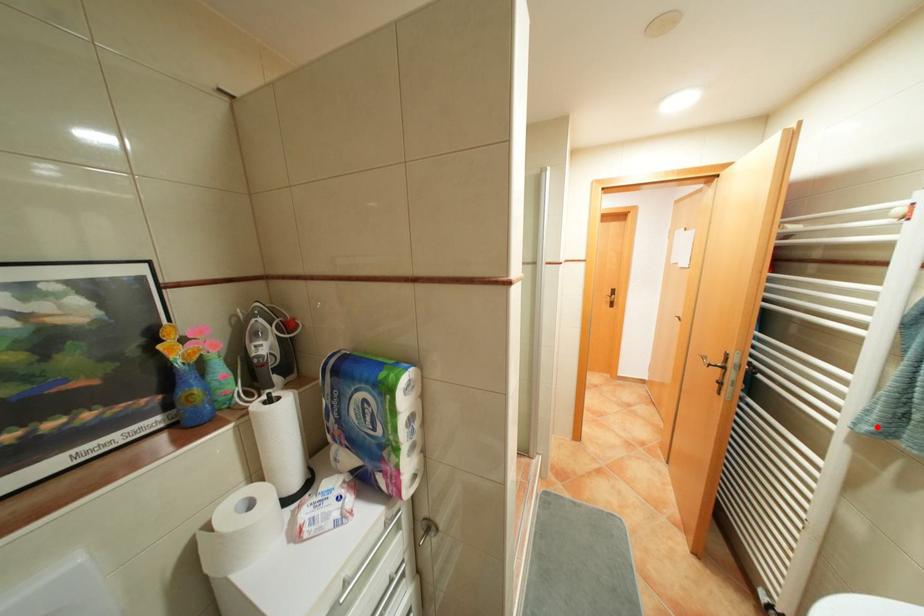
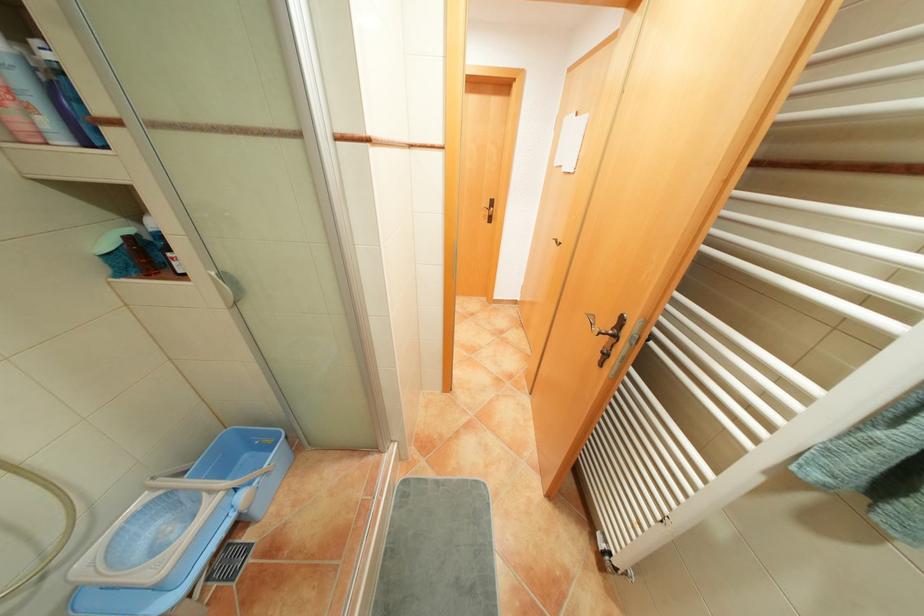
Locate, in the second image, the point that corresponds to the highlighted location in the first image.

(828, 475)